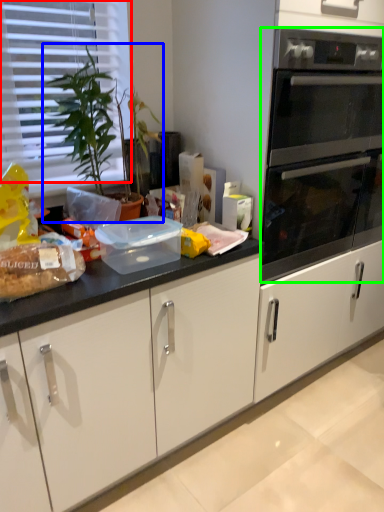
Question: Estimate the real-world distances between objects in this image. Which object is closer to blind (highlighted by a red box), houseplant (highlighted by a blue box) or oven (highlighted by a green box)?

Choices:
 (A) houseplant
 (B) oven

Answer: (A)